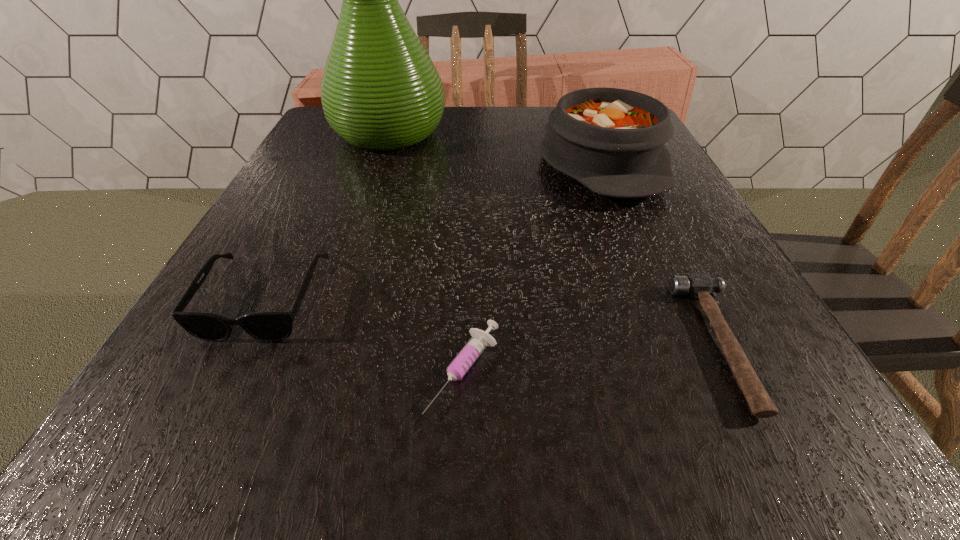
You are a GUI agent. You are given a task and a screenshot of the screen. Output one action in this format:
    pyautogui.click(x=<x>, y=<y>)
    Task: Click on the object located at the far left corner
    The height and width of the screenshot is (540, 960).
    Given the screenshot: What is the action you would take?
    pyautogui.click(x=380, y=91)

Where is `object that is at the far right corner`? object that is at the far right corner is located at coordinates (611, 140).

The height and width of the screenshot is (540, 960). Find the location of `object located at the near right corner`. object located at the near right corner is located at coordinates (699, 285).

The height and width of the screenshot is (540, 960). In order to click on free space at the far edge in this screenshot , I will do `click(489, 149)`.

In the image, there is a desktop. What are the coordinates of `vacant space at the near edge` in the screenshot? It's located at (405, 430).

The width and height of the screenshot is (960, 540). Identify the location of free space at the left edge of the desktop. (330, 185).

I want to click on vacant space at the right edge, so click(651, 199).

This screenshot has width=960, height=540. In the image, there is a desktop. In order to click on vacant space at the near left corner in this screenshot , I will do `click(152, 434)`.

Identify the location of free location at the near right corner. [783, 409].

Identify the location of free space between the hammer and the tallest object. The height and width of the screenshot is (540, 960). (555, 238).